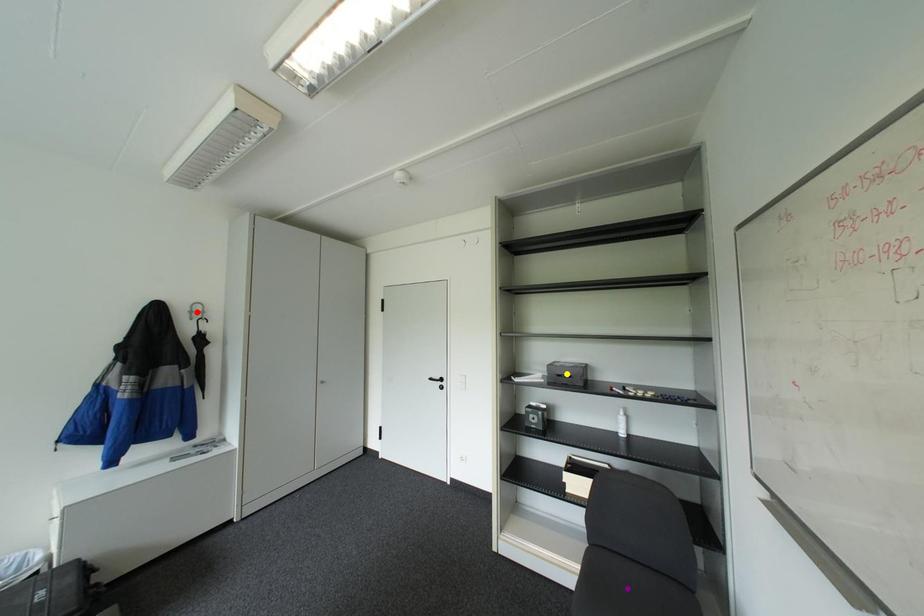
Order these from nearest to farthest:
yellow point | red point | purple point

purple point, yellow point, red point